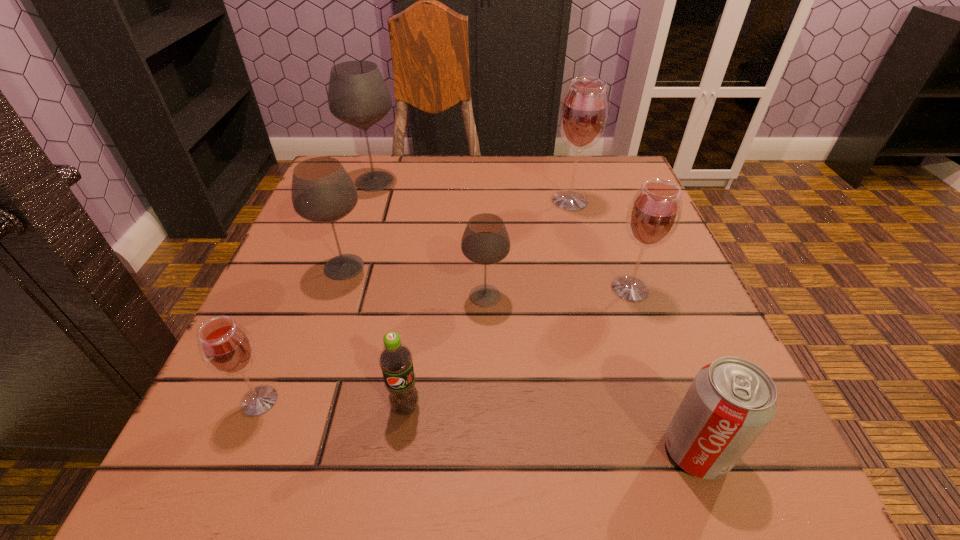
What are the coordinates of `the biggest gray wineglass` in the screenshot? It's located at (358, 95).

Identify the location of the farthest red wineglass. (584, 111).

Locate an element on the screen. the second biggest gray wineglass is located at coordinates (322, 191).

At what (x,y) coordinates should I click in order to perform the action: click on the second smallest red wineglass. Please return your answer as a coordinate pair (x, y). This screenshot has height=540, width=960. Looking at the image, I should click on (653, 215).

The width and height of the screenshot is (960, 540). I want to click on the rightmost gray wineglass, so click(485, 241).

Where is `the third wineglass from right to left`? the third wineglass from right to left is located at coordinates [485, 241].

What are the coordinates of `the nearest wineglass` in the screenshot? It's located at (226, 347).

The image size is (960, 540). Identify the location of the smallest red wineglass. (226, 347).

Identify the location of the farther soda can. (395, 360).

The width and height of the screenshot is (960, 540). Identify the location of the fifth object from right to left. (395, 360).